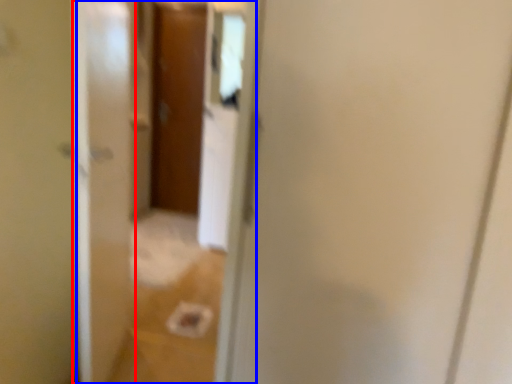
Question: Which object is further to the camera taking this photo, screen door (highlighted by a red box) or glass door (highlighted by a blue box)?

Choices:
 (A) screen door
 (B) glass door

Answer: (B)